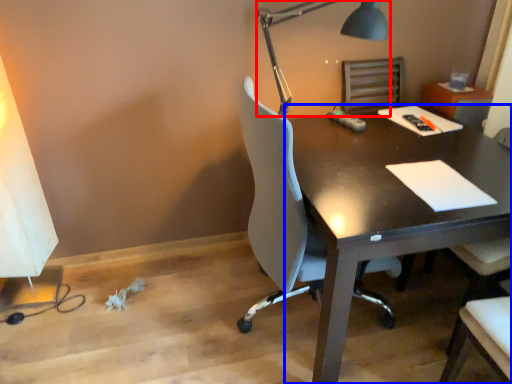
Question: Which of the following is the farthest to the observer, lamp (highlighted by a red box) or desk (highlighted by a blue box)?

Choices:
 (A) lamp
 (B) desk

Answer: (A)